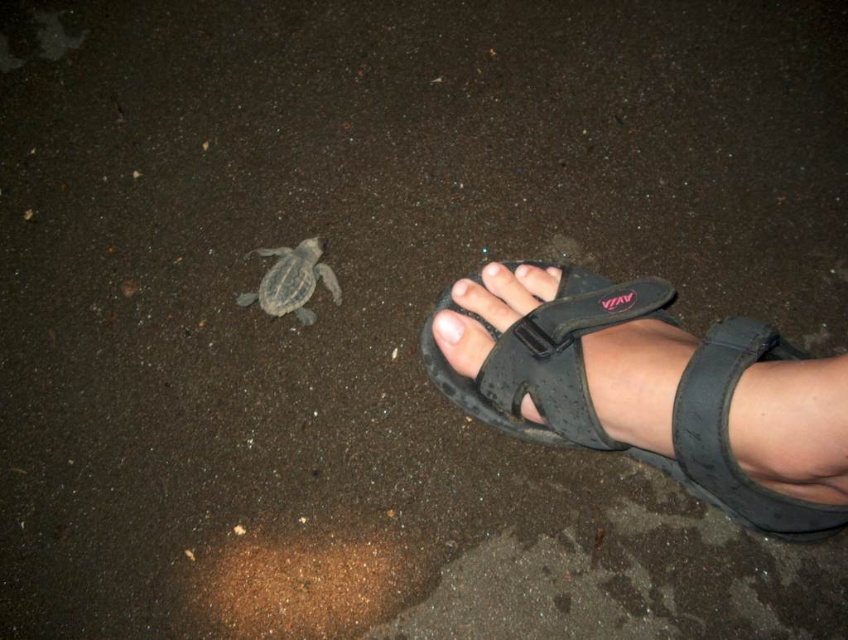
Measure the distance from smooth skin toe at center to matte black toe at center.

smooth skin toe at center and matte black toe at center are 1.09 inches apart from each other.

Who is more distant from viewer, [462,294] or [488,268]?

Positioned behind is point [488,268].

Find the location of a particular element. smooth skin toe at center is located at coordinates (460, 288).

Is black synthetic sandal at lower right to the left of matte black toe at center from the viewer's perspective?

Incorrect, black synthetic sandal at lower right is not on the left side of matte black toe at center.

Which is behind, point (801, 384) or point (486, 275)?

The point (486, 275) is behind.

Between point (685, 426) and point (483, 268), which one is positioned behind?

The point (483, 268) is behind.

This screenshot has width=848, height=640. In order to click on black synthetic sandal at lower right in this screenshot , I will do `click(654, 390)`.

Is pale skin toe at center shorter than smooth skin toe at center?

No.

Is point (438, 342) farther from camera compared to point (473, 280)?

No, (438, 342) is closer to viewer.

The width and height of the screenshot is (848, 640). I want to click on pale skin toe at center, so click(448, 326).